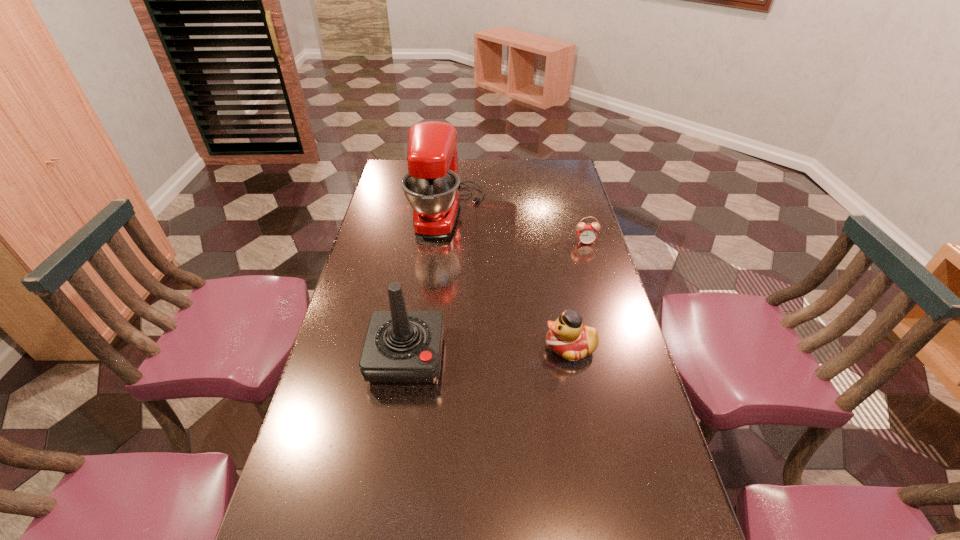
At what (x,y) coordinates should I click in order to perform the action: click on free location that satisfies the following two spatial constraints: 1. on the clock face of the rightmost object; 2. on the face of the third tallest object. Please return your answer as a coordinate pair (x, y). This screenshot has width=960, height=540. Looking at the image, I should click on (616, 347).